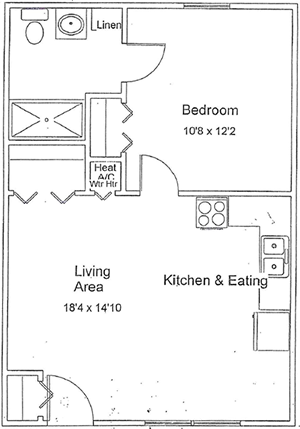
Identify the location of sink. This screenshot has height=429, width=300. (268, 260).